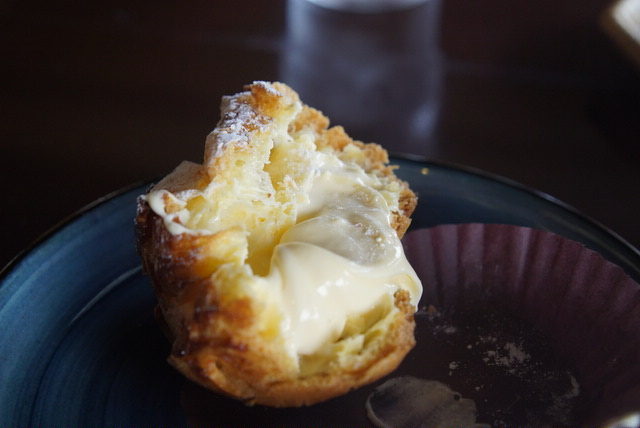
Locate an element on the screen. The height and width of the screenshot is (428, 640). black table is located at coordinates (539, 167).